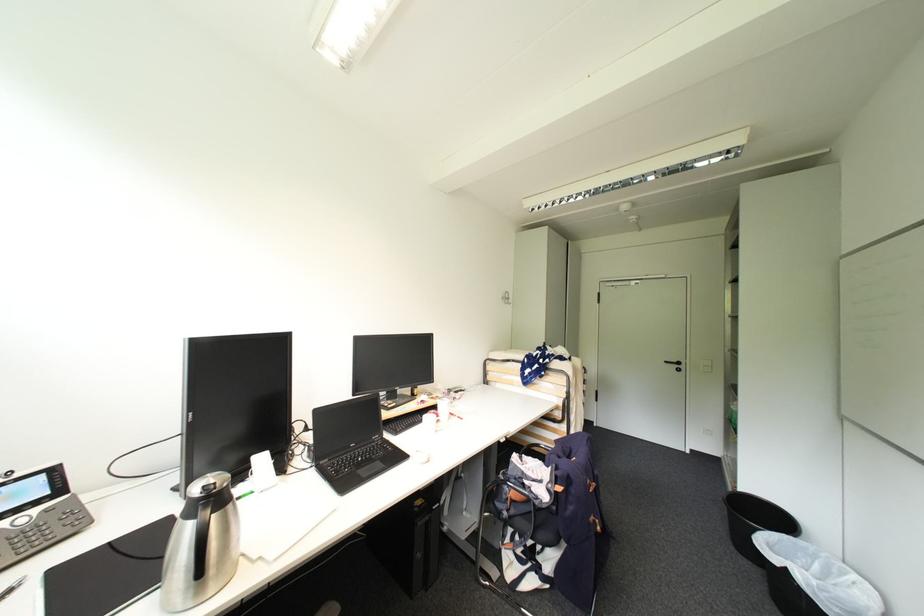
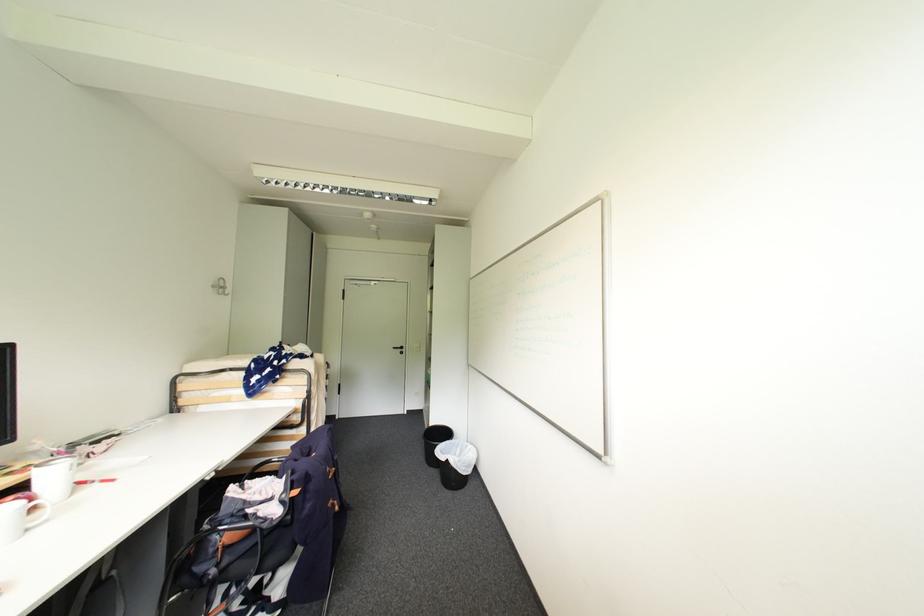
Question: The camera is either moving clockwise (left) or counter-clockwise (right) around the object. The first image is from the beginning of the video and the second image is from the end. Is the camera moving left or right when shooting the video?

Choices:
 (A) Left
 (B) Right

Answer: (A)